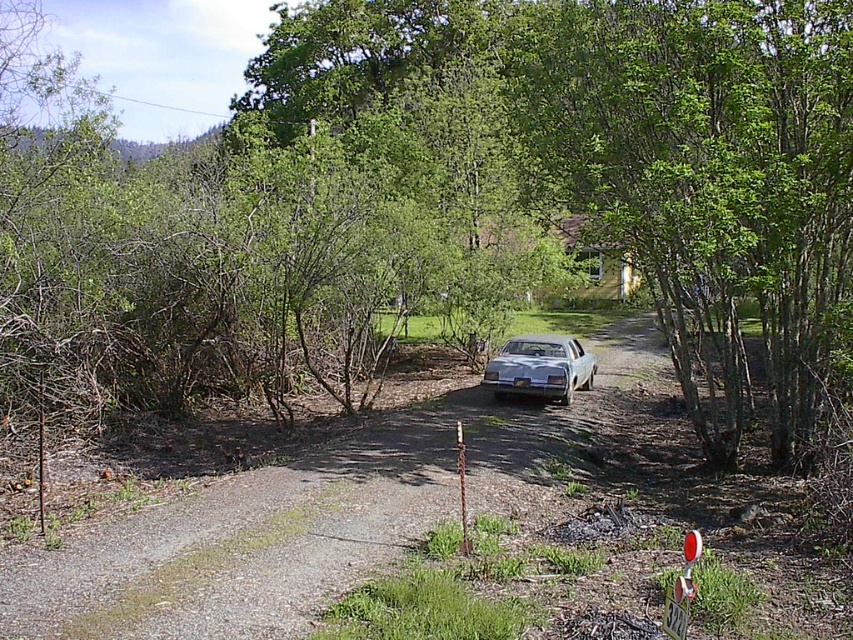
Does green leafy tree at center lie in front of silver metallic car at center?

Yes, green leafy tree at center is closer to the viewer.

This screenshot has width=853, height=640. Identify the location of green leafy tree at center. (454, 195).

The height and width of the screenshot is (640, 853). In order to click on green leafy tree at center in this screenshot , I will do `click(454, 195)`.